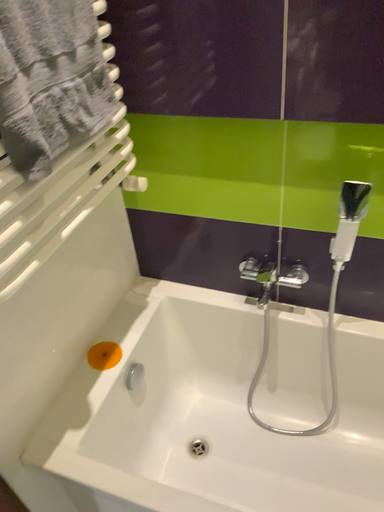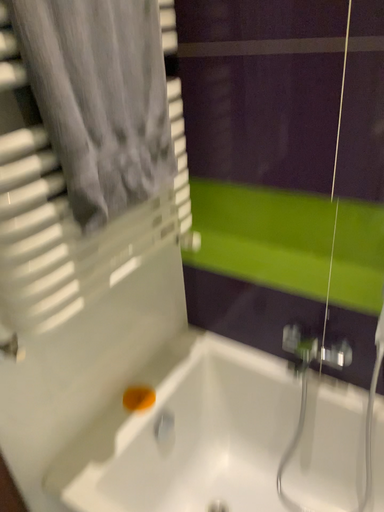
Question: Which way did the camera rotate in the video?

Choices:
 (A) rotated right
 (B) rotated left

Answer: (B)